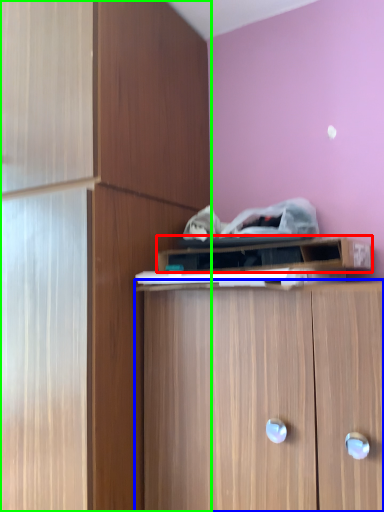
Question: Considering the real-world distances, which object is closest to cabinetry (highlighted by a red box)? cabinetry (highlighted by a blue box) or cabinetry (highlighted by a green box).

Choices:
 (A) cabinetry
 (B) cabinetry

Answer: (A)